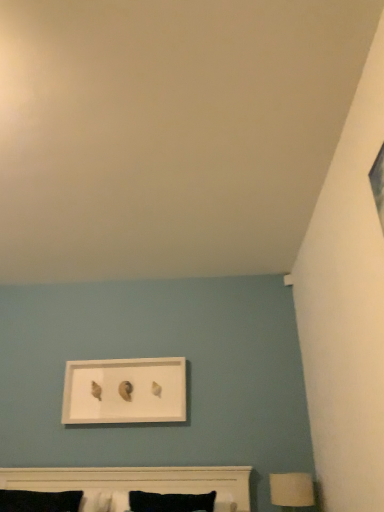
This screenshot has height=512, width=384. Describe the element at coordinates (291, 490) in the screenshot. I see `white matte table lamp at lower right` at that location.

Image resolution: width=384 pixels, height=512 pixels. What do you see at coordinates (139, 481) in the screenshot? I see `white matte bed at lower center` at bounding box center [139, 481].

The image size is (384, 512). Find the location of `white matte bed at lower center`. white matte bed at lower center is located at coordinates (139, 481).

What is the approximate width of white matte picture frame at upper center?

4.43 inches.

Identify the location of white matte table lamp at lower right. The width and height of the screenshot is (384, 512). (291, 490).

Is white matte bed at lower center not close to white matte table lamp at lower right?

No, there isn't a large distance between white matte bed at lower center and white matte table lamp at lower right.

From a real-world perspective, who is located lower, white matte bed at lower center or white matte table lamp at lower right?

white matte table lamp at lower right.

Between white matte bed at lower center and white matte table lamp at lower right, which one is positioned behind?

white matte table lamp at lower right is behind.

Does white matte bed at lower center appear on the left side of white matte table lamp at lower right?

Indeed, white matte bed at lower center is positioned on the left side of white matte table lamp at lower right.

You are a GUI agent. You are given a task and a screenshot of the screen. Output one action in this format:
    pyautogui.click(x=<x>, y=<y>)
    Task: Click on the bed on the right of white matte picture frame at upper center
    The image size is (384, 512).
    Given the screenshot: What is the action you would take?
    pyautogui.click(x=139, y=481)

From the image's perspective, is white matte picture frame at upper center on top of white matte bed at lower center?

Yes.

Which of these two, white matte picture frame at upper center or white matte bed at lower center, stands taller?

white matte picture frame at upper center.

Based on their sizes in the image, would you say white matte picture frame at upper center is bigger or smaller than white matte bed at lower center?

white matte picture frame at upper center is smaller than white matte bed at lower center.

Between white matte table lamp at lower right and white matte bed at lower center, which one has larger size?

With larger size is white matte bed at lower center.

Is white matte table lamp at lower right completely or partially outside of white matte bed at lower center?

Indeed, white matte table lamp at lower right is completely outside white matte bed at lower center.

From a real-world perspective, does white matte table lamp at lower right sit lower than white matte bed at lower center?

Yes, from a real-world perspective, white matte table lamp at lower right is below white matte bed at lower center.

Is point (304, 481) positioned in front of point (166, 484)?

No, (304, 481) is behind (166, 484).

Is white matte picture frame at upper center taller than white matte table lamp at lower right?

Yes, white matte picture frame at upper center is taller than white matte table lamp at lower right.

Which is behind, point (93, 413) or point (273, 500)?

The point (93, 413) is farther from the camera.

Is white matte table lamp at lower right completely or partially inside white matte picture frame at upper center?

No, white matte table lamp at lower right is not inside white matte picture frame at upper center.

Consider the image. Could you tell me if white matte picture frame at upper center is facing white matte table lamp at lower right?

No, white matte picture frame at upper center does not turn towards white matte table lamp at lower right.

Between white matte bed at lower center and white matte picture frame at upper center, which one has more height?

Standing taller between the two is white matte picture frame at upper center.

Looking at this image, is white matte bed at lower center further to the viewer compared to white matte picture frame at upper center?

No, white matte bed at lower center is closer to the camera.

Is white matte picture frame at upper center located within white matte bed at lower center?

Definitely not — white matte picture frame at upper center is not inside white matte bed at lower center.

Can you confirm if white matte bed at lower center is positioned to the left of white matte picture frame at upper center?

Incorrect, white matte bed at lower center is not on the left side of white matte picture frame at upper center.

Find the location of a particular element. Image resolution: width=384 pixels, height=512 pixels. table lamp that appears below the white matte picture frame at upper center (from the image's perspective) is located at coordinates 291,490.

Looking at this image, considering the positions of objects white matte table lamp at lower right and white matte picture frame at upper center in the image provided, who is more to the left, white matte table lamp at lower right or white matte picture frame at upper center?

Positioned to the left is white matte picture frame at upper center.

Does white matte table lamp at lower right have a lesser width compared to white matte picture frame at upper center?

In fact, white matte table lamp at lower right might be wider than white matte picture frame at upper center.

Who is taller, white matte table lamp at lower right or white matte picture frame at upper center?

Standing taller between the two is white matte picture frame at upper center.

In the image, there is a white matte bed at lower center. Find the location of `table lamp below it (from the image's perspective)`. table lamp below it (from the image's perspective) is located at coordinates (291, 490).

Image resolution: width=384 pixels, height=512 pixels. In order to click on picture frame on the left of white matte bed at lower center in this screenshot , I will do `click(125, 391)`.

From the image, which object appears to be farther from white matte picture frame at upper center, white matte bed at lower center or white matte table lamp at lower right?

white matte table lamp at lower right is positioned further to the anchor white matte picture frame at upper center.

Looking at the image, which one is located closer to white matte table lamp at lower right, white matte picture frame at upper center or white matte bed at lower center?

white matte bed at lower center is positioned closer to the anchor white matte table lamp at lower right.

Considering their positions, is white matte table lamp at lower right positioned further to white matte picture frame at upper center than white matte bed at lower center?

white matte table lamp at lower right lies further to white matte picture frame at upper center than the other object.

From the image, which object appears to be nearer to white matte bed at lower center, white matte table lamp at lower right or white matte picture frame at upper center?

white matte picture frame at upper center is positioned closer to the anchor white matte bed at lower center.

From the image, which object appears to be farther from white matte table lamp at lower right, white matte bed at lower center or white matte picture frame at upper center?

Based on the image, white matte picture frame at upper center appears to be further to white matte table lamp at lower right.

When comparing their distances from white matte bed at lower center, does white matte picture frame at upper center or white matte table lamp at lower right seem closer?

white matte picture frame at upper center.

Locate an element on the screen. bed between white matte picture frame at upper center and white matte table lamp at lower right is located at coordinates (139, 481).